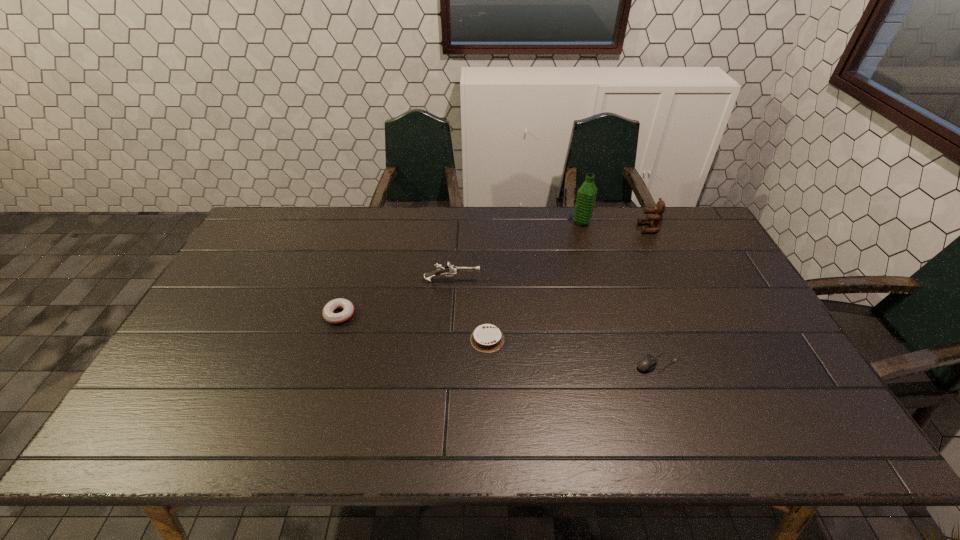
Locate an element on the screen. unoccupied area between the mouse and the fifth shortest object is located at coordinates (653, 295).

Locate an element on the screen. This screenshot has height=540, width=960. free space between the mouse and the teddy bear is located at coordinates (653, 295).

Where is `empty space that is in between the leftmost object and the chocolate cake`? The height and width of the screenshot is (540, 960). empty space that is in between the leftmost object and the chocolate cake is located at coordinates (414, 327).

The width and height of the screenshot is (960, 540). Identify the location of free spot between the mouse and the teddy bear. (653, 295).

This screenshot has width=960, height=540. I want to click on empty space between the tallest object and the gun, so click(x=516, y=252).

This screenshot has height=540, width=960. In order to click on empty location between the mouse and the gun in this screenshot , I will do `click(554, 322)`.

At what (x,y) coordinates should I click in order to perform the action: click on object that is the closest one to the tallest object. Please return your answer as a coordinate pair (x, y). Looking at the image, I should click on (655, 221).

Where is `object that stands as the second closest to the fourth nearest object`? This screenshot has width=960, height=540. object that stands as the second closest to the fourth nearest object is located at coordinates (335, 318).

Locate an element on the screen. The height and width of the screenshot is (540, 960). free point that satisfies the following two spatial constraints: 1. on the back side of the chocolate cake; 2. on the right side of the water bottle is located at coordinates (486, 222).

What are the coordinates of `free location that satisfies the following two spatial constraints: 1. aimed along the barrel of the chocolate cake; 2. on the right side of the fourth nearest object` in the screenshot? It's located at (448, 339).